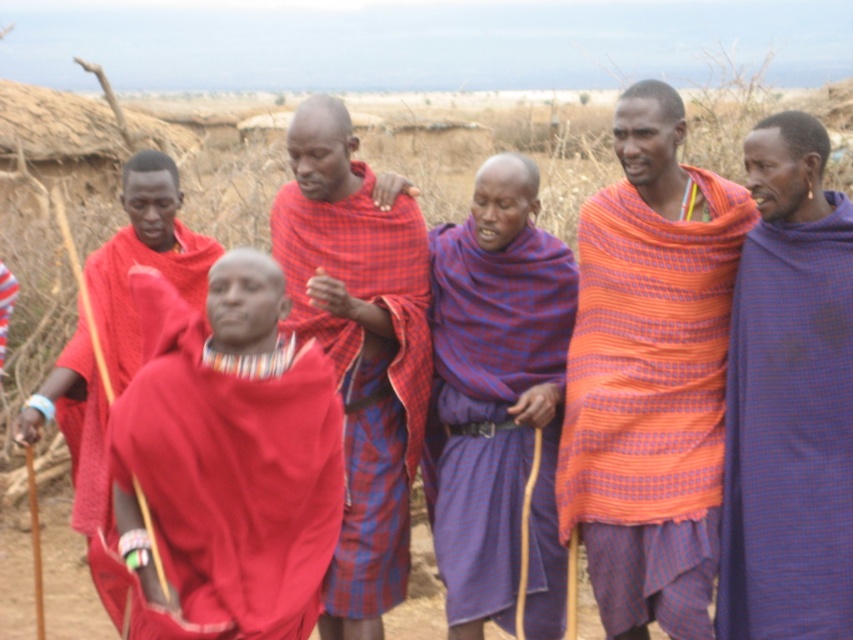
You are a photographer trying to capture the scene with the orange woven cloth at center and the matte red shawl at center. Which object is positioned to the right side of the other?

The orange woven cloth at center is to the right of matte red shawl at center.

Looking at this image, you are a photographer trying to capture the vibrant colors of the orange woven cloth at center and the matte red shawl at center. Since you want to highlight the size difference between them, which object should you focus on to ensure the viewer notices the size difference?

The orange woven cloth at center is larger in size than the matte red shawl at center, so focusing on the orange woven cloth at center will emphasize its larger size compared to the matte red shawl at center.